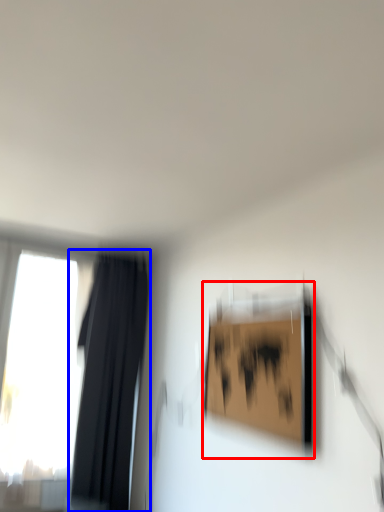
Question: Which of the following is the closest to the observer, picture frame (highlighted by a red box) or curtain (highlighted by a blue box)?

Choices:
 (A) picture frame
 (B) curtain

Answer: (A)